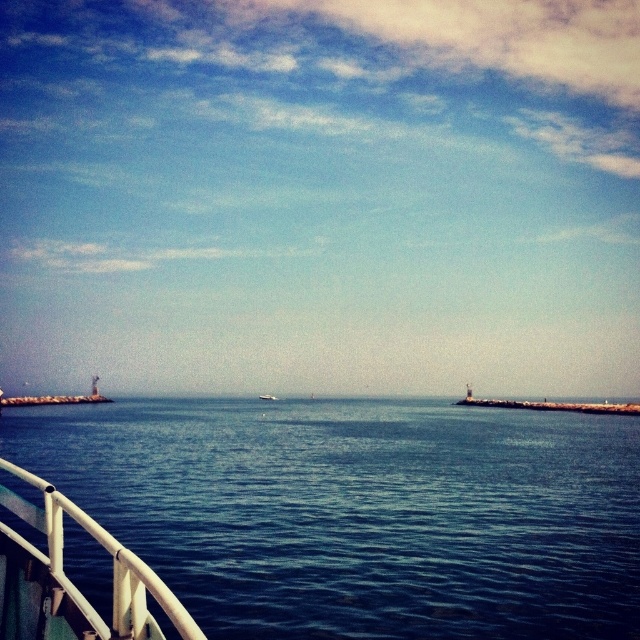
You are a photographer standing at the center of the seascape. You want to take a photo that includes both point [147,636] and point [276,397]. Which point should you focus on first to ensure both are in the frame?

You should focus on point [147,636] first because it is closer to the viewer than point [276,397], ensuring both points remain within the frame.